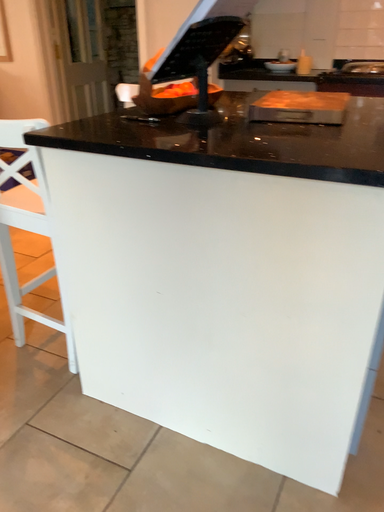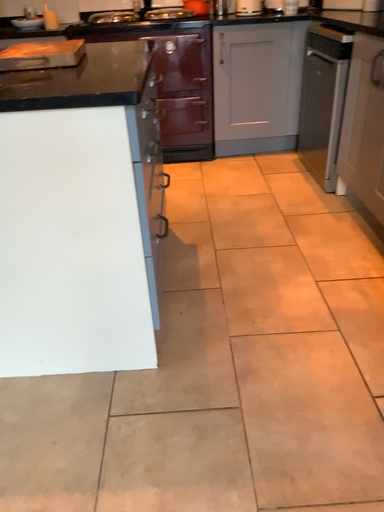
Question: How did the camera likely rotate when shooting the video?

Choices:
 (A) rotated left
 (B) rotated right

Answer: (B)